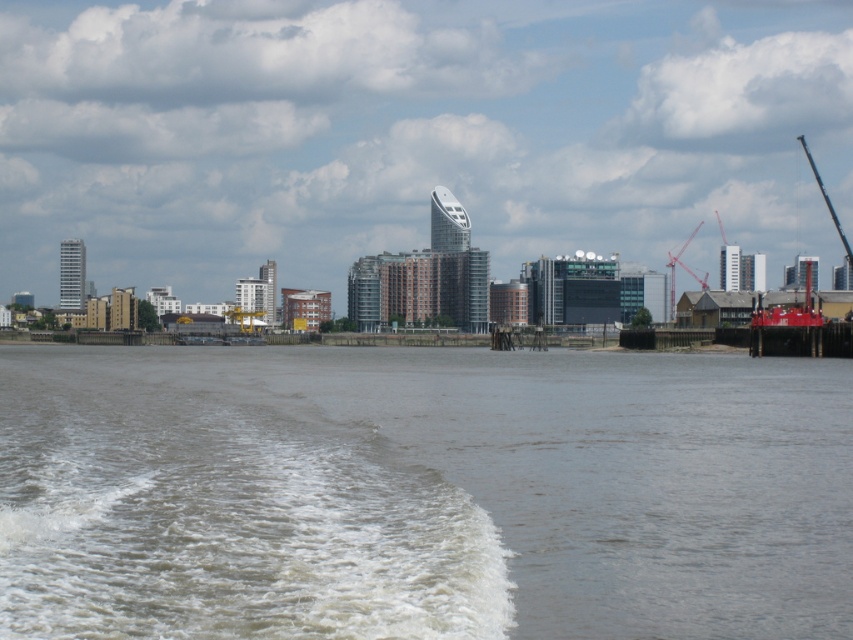
Question: Which point is closer to the camera?

Choices:
 (A) brown muddy water at lower left
 (B) metallic gray crane at upper right
 (C) metallic red crane at right

Answer: (A)

Question: Can you confirm if brown muddy water at lower left is positioned below metallic gray crane at upper right?

Choices:
 (A) yes
 (B) no

Answer: (A)

Question: Can you confirm if brown muddy water at lower left is bigger than metallic red crane at right?

Choices:
 (A) yes
 (B) no

Answer: (B)

Question: Which point is farther to the camera?

Choices:
 (A) brown muddy water at lower left
 (B) metallic red crane at right

Answer: (B)

Question: Is brown muddy water at lower left thinner than metallic red crane at right?

Choices:
 (A) no
 (B) yes

Answer: (A)

Question: Which object appears closest to the camera in this image?

Choices:
 (A) metallic red crane at right
 (B) metallic gray crane at upper right
 (C) brown muddy water at lower left

Answer: (C)